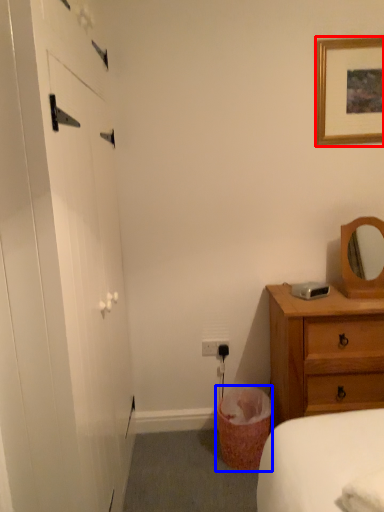
Question: Which of the following is the farthest to the observer, picture frame (highlighted by a red box) or laundry basket (highlighted by a blue box)?

Choices:
 (A) picture frame
 (B) laundry basket

Answer: (A)